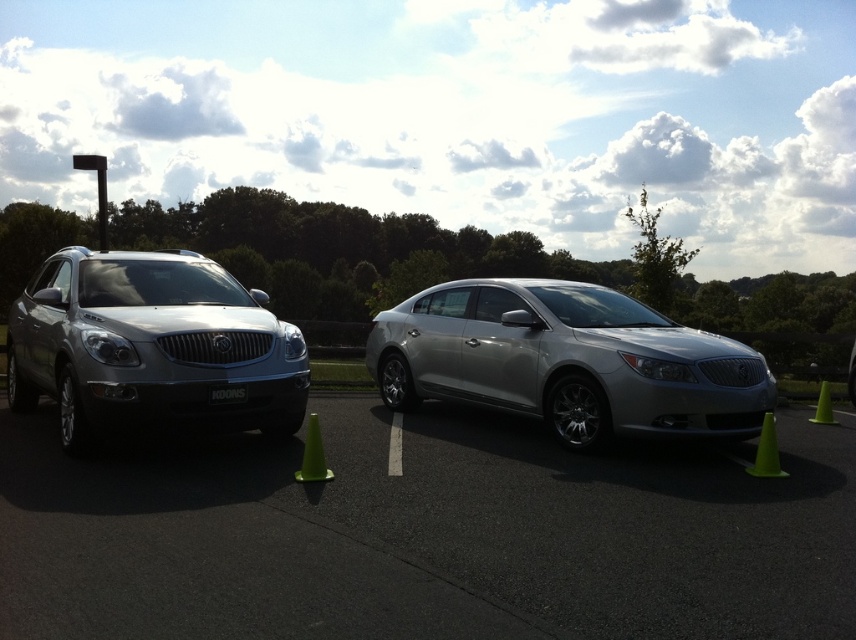
Looking at this image, you are a parking attendant and need to move the green plastic traffic cone at lower right to a different location. Which direction should you move it so it doesn not block the satin silver car at center when it leaves?

The satin silver car at center is in front of the green plastic traffic cone at lower right. To prevent blocking the car, move the green plastic traffic cone at lower right to a position behind the car or to the side, ensuring it is not in the path of the vehicle when it departs.

You are a delivery person trying to park your van between the green plastic traffic cone at right and the black plastic license plate at center. Your van is 8 meters long. Can you fit it between them without overlapping either object?

The distance between the green plastic traffic cone at right and the black plastic license plate at center is 8.60 meters. Since your van is 8 meters long, there is enough space to park between them without overlapping either object.

You are a delivery person trying to park your van between the satin silver suv at left and the green plastic cone at lower left. Can your van fit vertically between them if your van is 1.8 meters tall?

The satin silver suv at left has a greater height compared to green plastic cone at lower left. Since the van is 1.8 meters tall, it depends on the minimum height clearance between the vehicles. However, since the SUV is taller, the clearance might be limited. Without exact measurements, it is uncertain if the van can fit vertically between them.